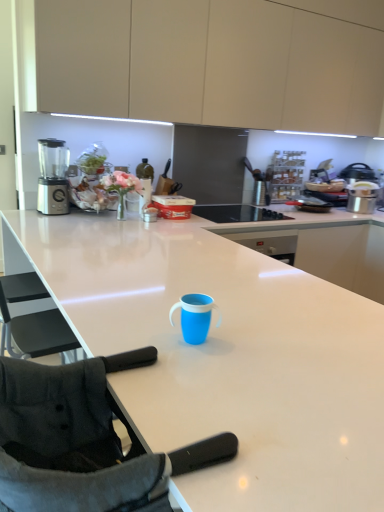
You are a GUI agent. You are given a task and a screenshot of the screen. Output one action in this format:
    pyautogui.click(x=<x>, y=<y>)
    Task: Click on the free point in front of satin silver blender at left
    This screenshot has height=512, width=384.
    Given the screenshot: What is the action you would take?
    pyautogui.click(x=48, y=215)